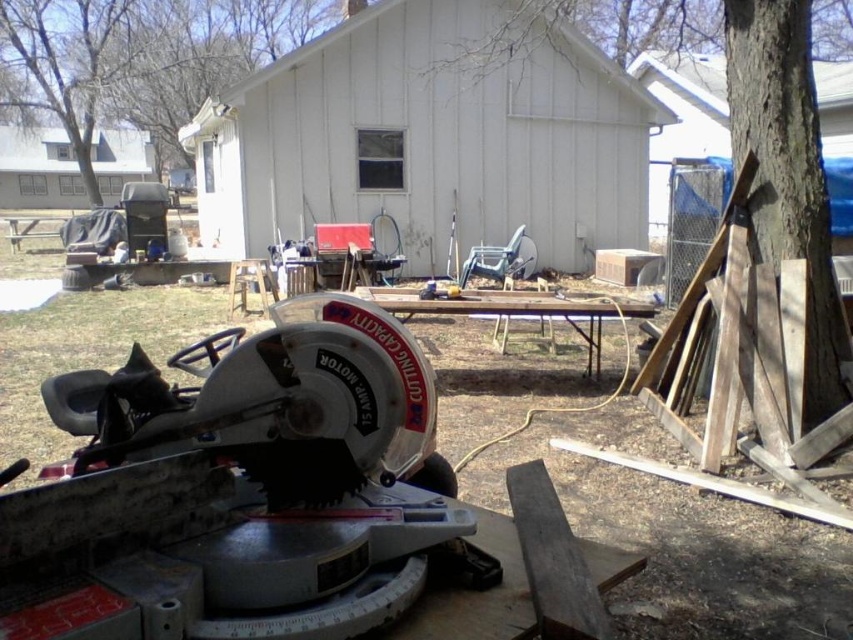
You are a contractor working in the backyard and need to assess the space. Which object is taller between the metallic gray circular saw at center and the brown rough bark tree at right?

The brown rough bark tree at right is taller than the metallic gray circular saw at center.

You are a contractor working in the backyard and need to cut a piece of wood. The metallic gray circular saw at center is your tool. Can you safely operate the saw while standing in front of it to cut the brown rough wood at right?

Yes, because the metallic gray circular saw at center is positioned in front of the brown rough wood at right, allowing safe and accessible operation for cutting.